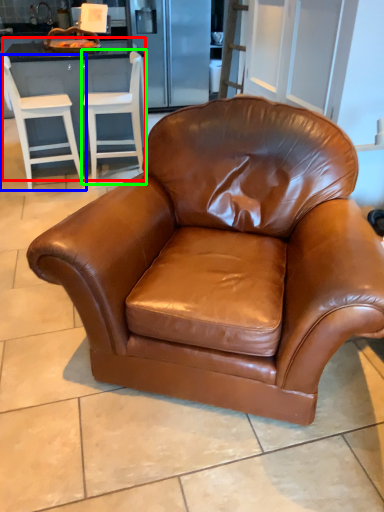
Question: Based on their relative distances, which object is nearer to dresser (highlighted by a red box)? Choose from chair (highlighted by a blue box) and chair (highlighted by a green box).

Choices:
 (A) chair
 (B) chair

Answer: (B)